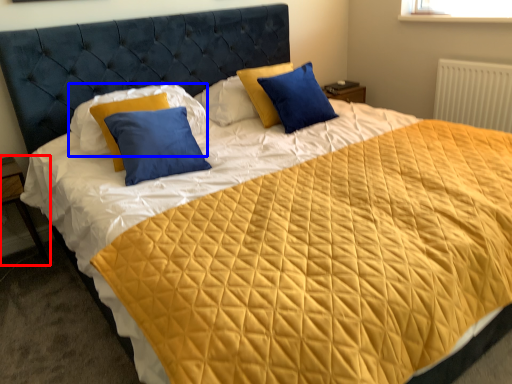
Question: Which object is closer to the camera taking this photo, nightstand (highlighted by a red box) or pillow (highlighted by a blue box)?

Choices:
 (A) nightstand
 (B) pillow

Answer: (B)